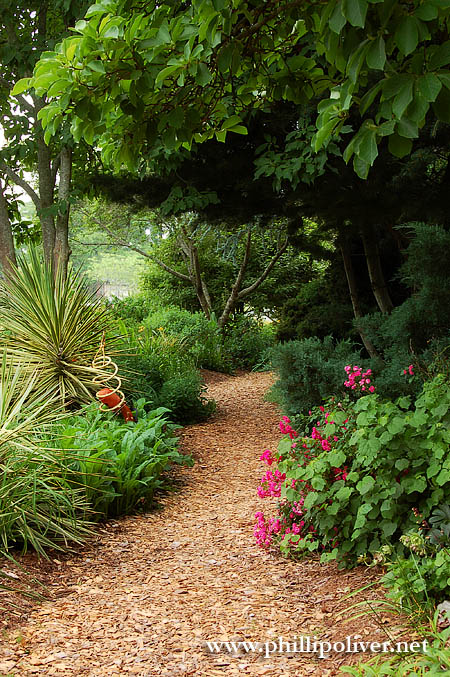
Locate an element on the screen. spiky plant is located at coordinates (59, 338), (21, 456).